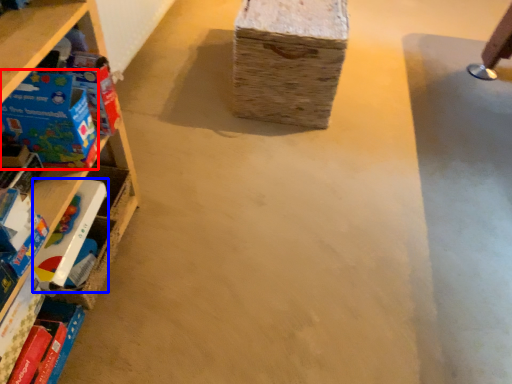
Question: Among these objects, which one is nearest to the camera, toy (highlighted by a red box) or toy (highlighted by a blue box)?

Choices:
 (A) toy
 (B) toy

Answer: (A)